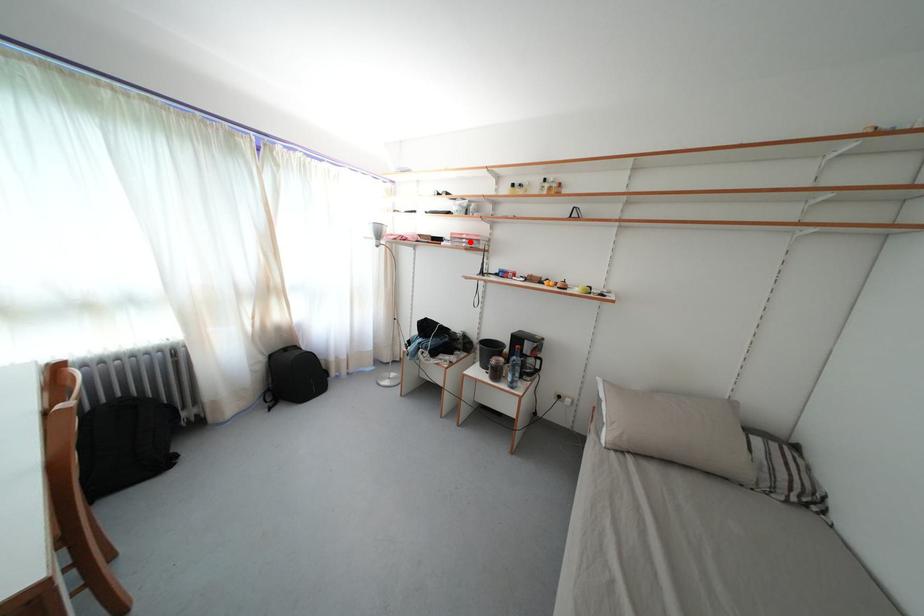
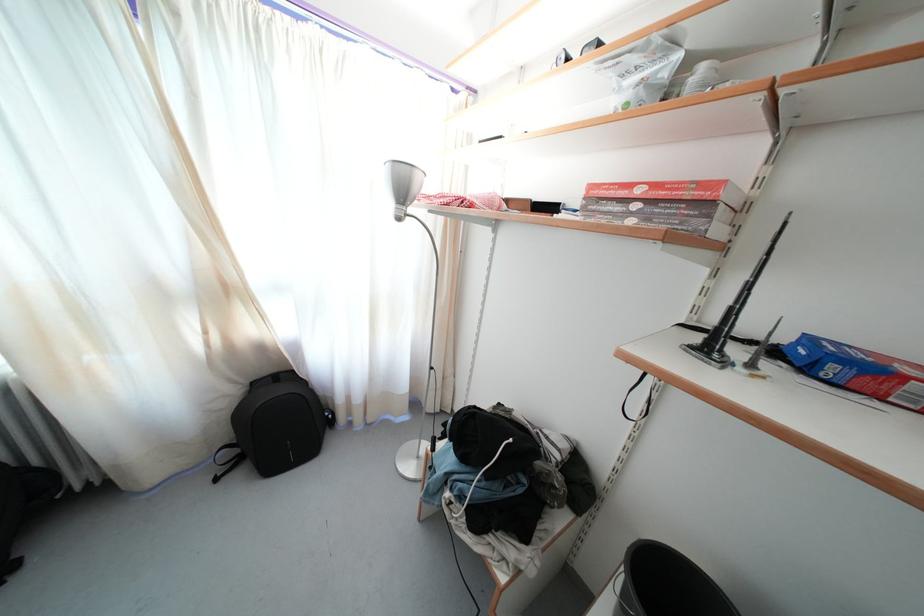
Where in the second image is the point corresponding to the highlighted location from the first image?

(645, 197)